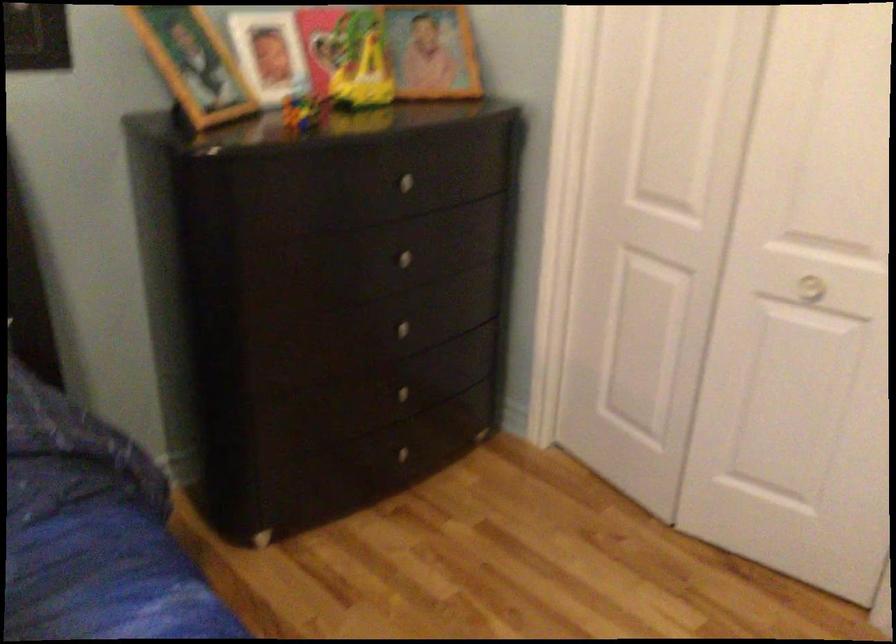
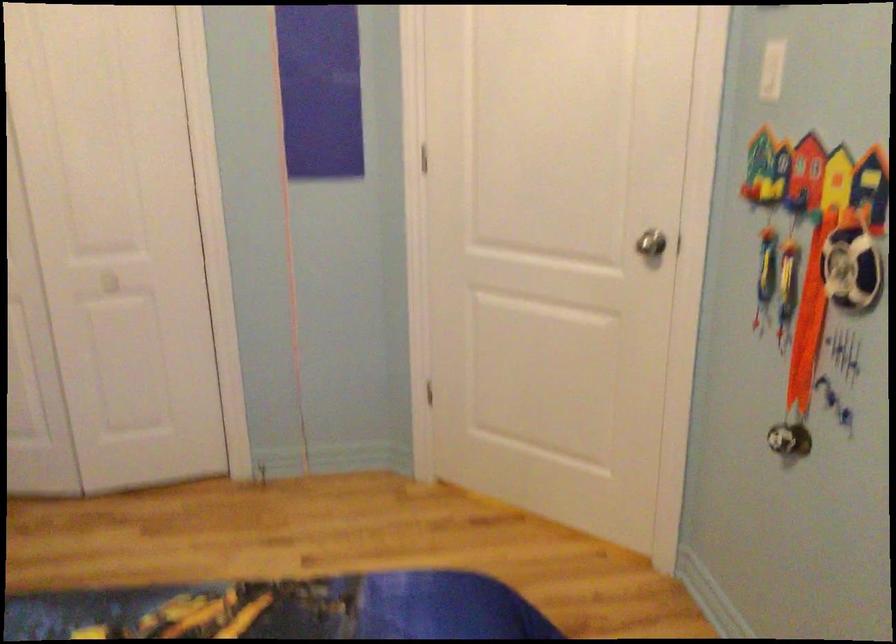
Question: The camera is either moving clockwise (left) or counter-clockwise (right) around the object. The first image is from the beginning of the video and the second image is from the end. Is the camera moving left or right when shooting the video?

Choices:
 (A) Left
 (B) Right

Answer: (A)